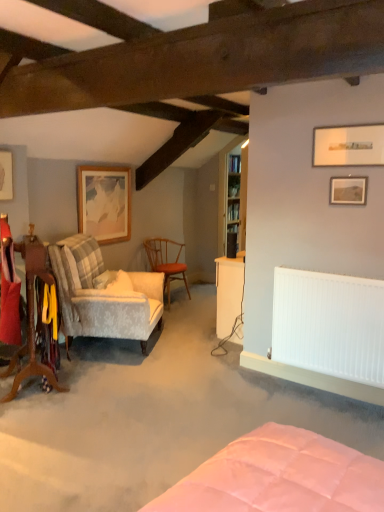
This screenshot has width=384, height=512. I want to click on free location to the right of wooden plaid chair at left, marked as the first chair in a front-to-back arrangement, so click(95, 391).